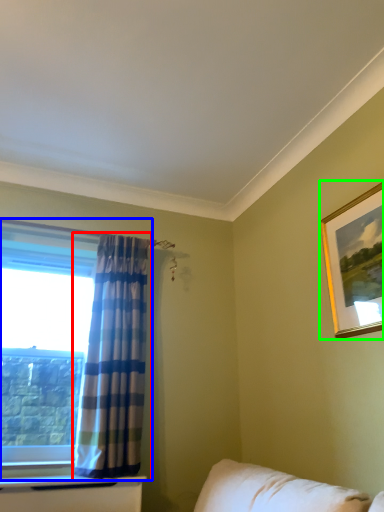
Question: Which object is the farthest from curtain (highlighted by a red box)? Choose among these: window (highlighted by a blue box) or picture frame (highlighted by a green box).

Choices:
 (A) window
 (B) picture frame

Answer: (B)